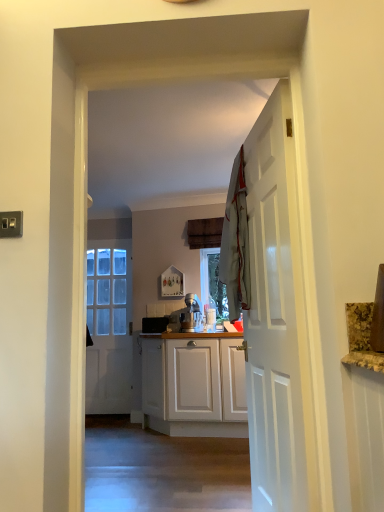
Question: In terms of size, does white wooden door at right, acting as the first door starting from the right, appear bigger or smaller than light gray fabric at center?

Choices:
 (A) big
 (B) small

Answer: (A)

Question: Is point (278, 250) closer or farther from the camera than point (238, 165)?

Choices:
 (A) closer
 (B) farther

Answer: (A)

Question: Estimate the real-world distances between objects in this image. Which object is farther from the white glossy door at center, the first door when ordered from left to right?

Choices:
 (A) white wooden door at right, positioned as the first door in front-to-back order
 (B) light gray fabric at center

Answer: (A)

Question: Based on their relative distances, which object is farther from the white glossy door at center, the first door when ordered from left to right?

Choices:
 (A) light gray fabric at center
 (B) white wooden door at right, acting as the first door starting from the right

Answer: (B)